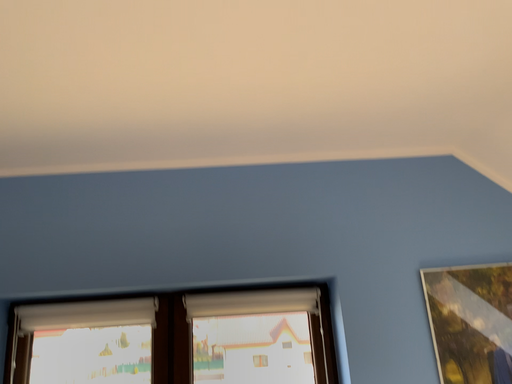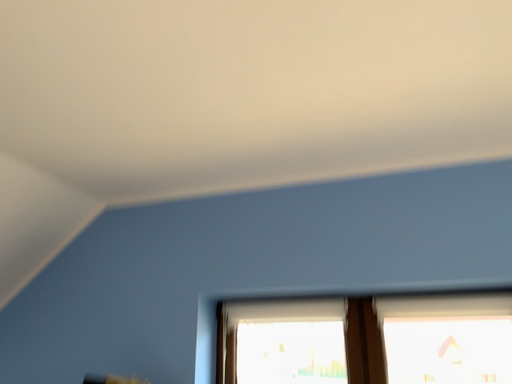
Question: How did the camera likely rotate when shooting the video?

Choices:
 (A) rotated left
 (B) rotated right

Answer: (A)